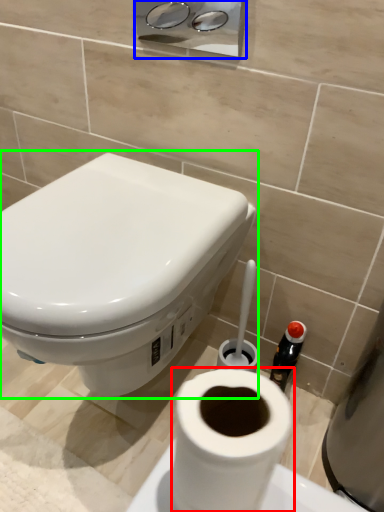
Question: Estimate the real-world distances between objects in this image. Which object is farther from toilet paper (highlighted by a red box), dispenser (highlighted by a blue box) or toilet (highlighted by a green box)?

Choices:
 (A) dispenser
 (B) toilet

Answer: (A)